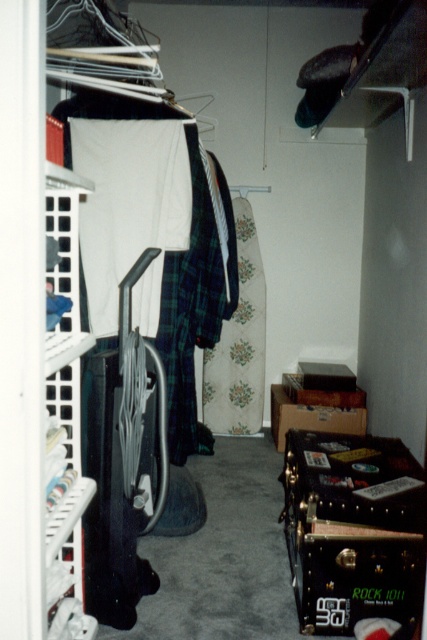
Is white fabric at center in front of floral fabric dress at center?

Yes, it is.

Between white fabric at center and floral fabric dress at center, which one is positioned lower?

Positioned lower is floral fabric dress at center.

You are a GUI agent. You are given a task and a screenshot of the screen. Output one action in this format:
    pyautogui.click(x=<x>, y=<y>)
    Task: Click on the white fabric at center
    The height and width of the screenshot is (640, 427).
    Given the screenshot: What is the action you would take?
    pyautogui.click(x=129, y=211)

In order to click on white fabric at center in this screenshot , I will do `click(129, 211)`.